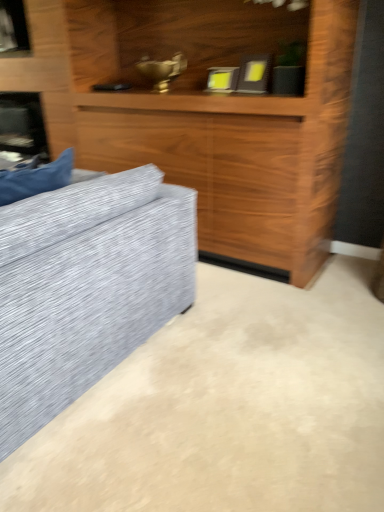
The image size is (384, 512). Identify the location of wooden entertainment center at upper center. (222, 120).

This screenshot has height=512, width=384. What do you see at coordinates (222, 120) in the screenshot?
I see `wooden entertainment center at upper center` at bounding box center [222, 120].

What is the approximate width of wooden entertainment center at upper center?

55.79 centimeters.

Identify the location of wooden entertainment center at upper center. This screenshot has height=512, width=384. (222, 120).